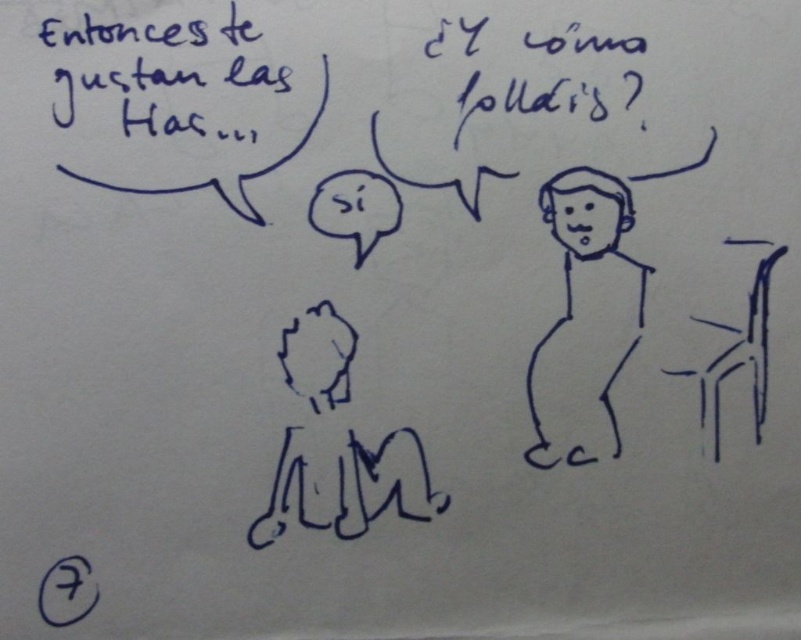
Question: Is the position of smooth black figure at center less distant than that of black line drawing of person at center?

Choices:
 (A) yes
 (B) no

Answer: (B)

Question: Which point is farther to the camera?

Choices:
 (A) smooth black figure at center
 (B) black line drawing of person at center
 (C) black handwritten text at upper left
 (D) black plastic chair at right

Answer: (D)

Question: Is smooth black figure at center above black plastic chair at right?

Choices:
 (A) no
 (B) yes

Answer: (A)

Question: Among these points, which one is farthest from the camera?

Choices:
 (A) (262, 515)
 (B) (771, 269)
 (C) (570, 291)
 (D) (129, 83)

Answer: (C)

Question: Is black handwritten text at upper left bigger than black line drawing of person at center?

Choices:
 (A) no
 (B) yes

Answer: (A)

Question: Among these objects, which one is nearest to the camera?

Choices:
 (A) black plastic chair at right
 (B) smooth black figure at center

Answer: (B)